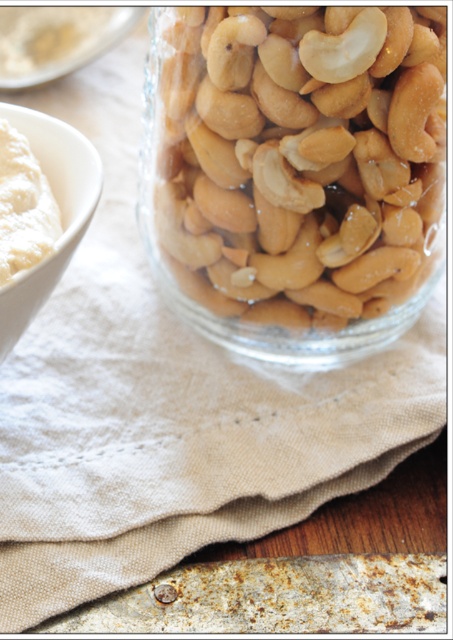
Question: Can you confirm if white matte bowl at left is bigger than white creamy spread at left?

Choices:
 (A) no
 (B) yes

Answer: (B)

Question: Can you confirm if shiny beige cashews at center is wider than white creamy spread at left?

Choices:
 (A) yes
 (B) no

Answer: (A)

Question: Among these objects, which one is farthest from the camera?

Choices:
 (A) shiny beige cashews at center
 (B) white creamy spread at left
 (C) white matte bowl at left

Answer: (A)

Question: Which of the following is the closest to the observer?

Choices:
 (A) white matte bowl at left
 (B) white creamy spread at left

Answer: (A)

Question: Which object is closer to the camera taking this photo?

Choices:
 (A) white matte bowl at left
 (B) shiny beige cashews at center

Answer: (A)

Question: Where is shiny beige cashews at center located in relation to white matte bowl at left in the image?

Choices:
 (A) below
 (B) above

Answer: (B)